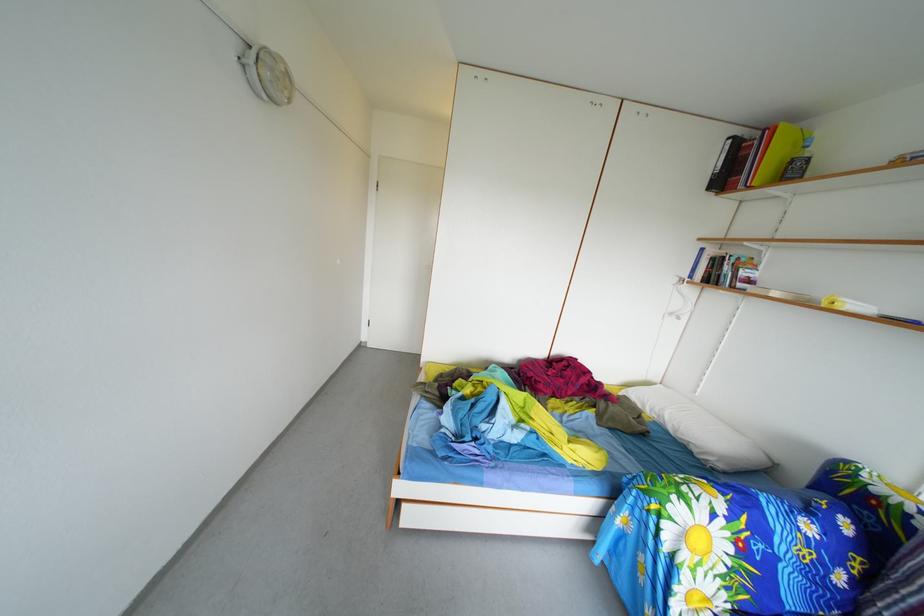
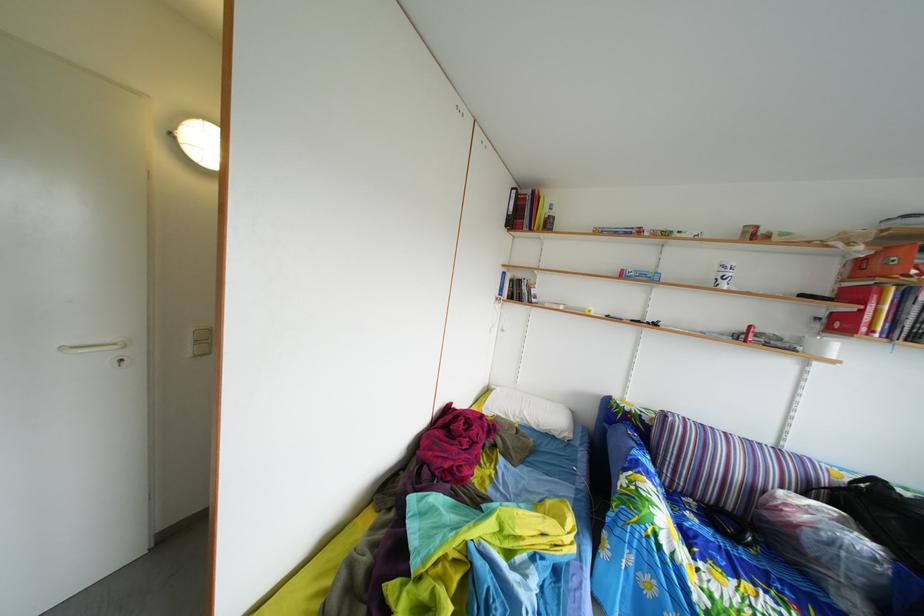
Question: I am providing you with two images of the same scene from different viewpoints. Please identify which objects are invisible in image2.

Choices:
 (A) black bag
 (B) striped pillow
 (C) plastic water bottle
 (D) none of these

Answer: (D)